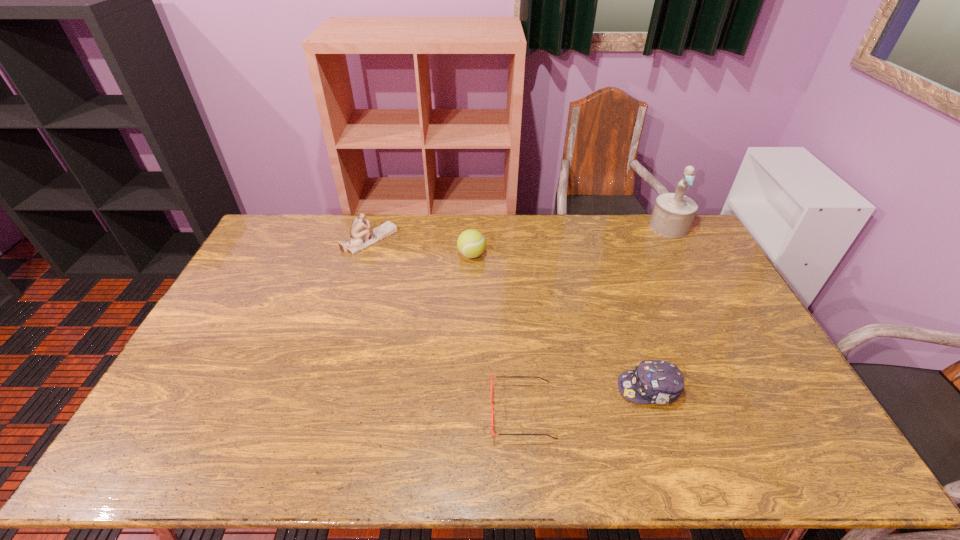
Locate an element on the screen. the taller figurine is located at coordinates (673, 213).

Identify the location of the right figurine. [673, 213].

Identify the location of the leftmost object. The height and width of the screenshot is (540, 960). (361, 238).

You are a GUI agent. You are given a task and a screenshot of the screen. Output one action in this format:
    pyautogui.click(x=<x>, y=<y>)
    Task: Click on the left figurine
    This screenshot has width=960, height=540.
    Given the screenshot: What is the action you would take?
    pyautogui.click(x=361, y=238)

The image size is (960, 540). What are the coordinates of `tennis ball` in the screenshot? It's located at (471, 243).

Image resolution: width=960 pixels, height=540 pixels. In order to click on the fourth object from right to left in this screenshot , I will do `click(471, 243)`.

At what (x,y) coordinates should I click in order to perform the action: click on headwear. Please return your answer as a coordinate pair (x, y). Image resolution: width=960 pixels, height=540 pixels. Looking at the image, I should click on (653, 381).

At what (x,y) coordinates should I click in order to perform the action: click on the second shortest object. Please return your answer as a coordinate pair (x, y). This screenshot has width=960, height=540. Looking at the image, I should click on (653, 381).

Identify the location of the third object from right to left. (492, 408).

Identify the location of the shortest object. This screenshot has width=960, height=540. (492, 408).